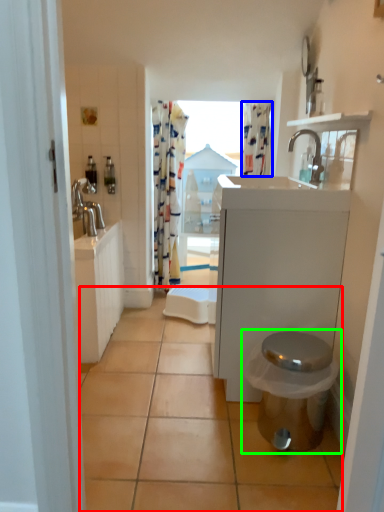
Question: Which object is the closest to the tile (highlighted by a red box)? Choose among these: shower curtain (highlighted by a blue box) or toilet (highlighted by a green box).

Choices:
 (A) shower curtain
 (B) toilet

Answer: (B)